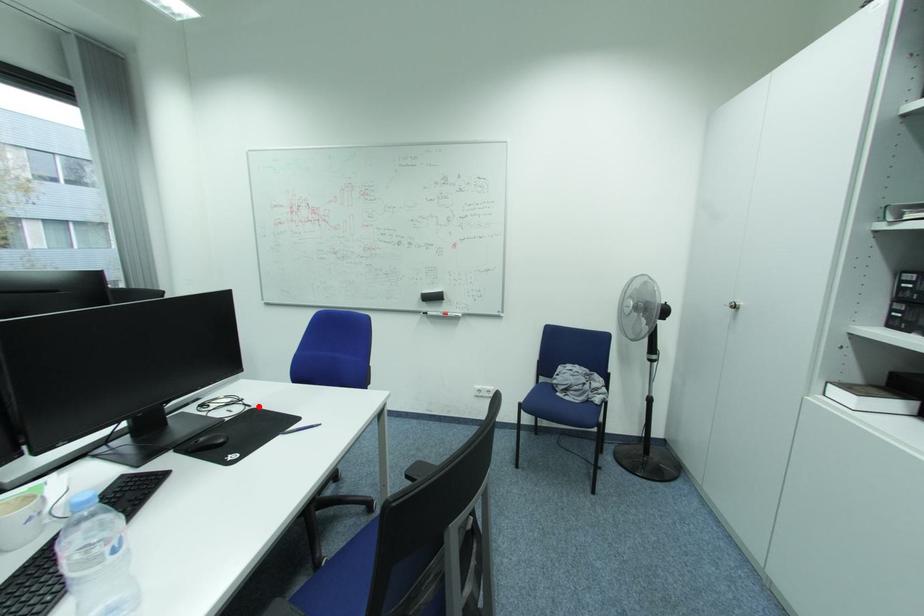
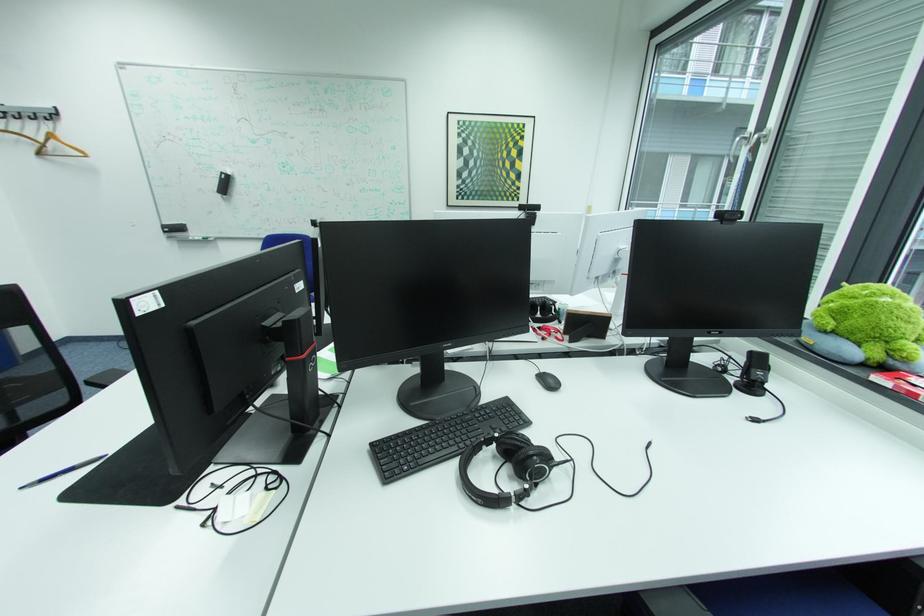
The point at the highlighted location is marked in the first image. Where is the corresponding point in the second image?

(187, 508)